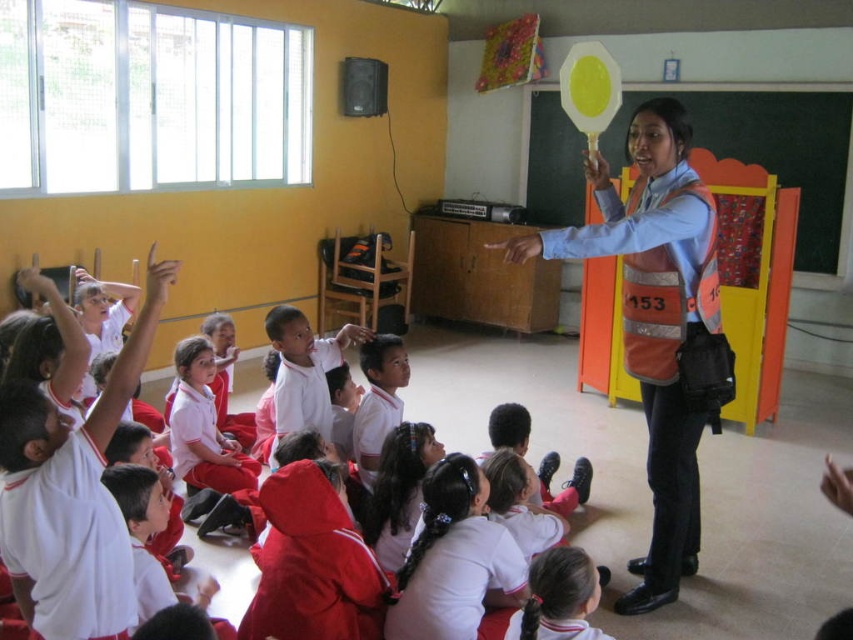
Question: Estimate the real-world distances between objects in this image. Which object is closer to the white fabric hair at center?

Choices:
 (A) white matte hairband at center
 (B) white smooth shirt at center

Answer: (A)

Question: Does orange reflective vest at center have a lesser width compared to white fabric hair at center?

Choices:
 (A) yes
 (B) no

Answer: (B)

Question: Is orange reflective vest at center further to the viewer compared to white matte hairband at center?

Choices:
 (A) no
 (B) yes

Answer: (B)

Question: Among these points, which one is farthest from the camera?

Choices:
 (A) (474, 570)
 (B) (669, 284)
 (C) (374, 420)
 (D) (578, 612)

Answer: (C)

Question: Which of the following is the farthest from the observer?

Choices:
 (A) (374, 440)
 (B) (511, 618)
 (C) (300, 365)
 (D) (631, 268)

Answer: (C)

Question: Is orange reflective vest at center above white fabric hair at center?

Choices:
 (A) yes
 (B) no

Answer: (A)